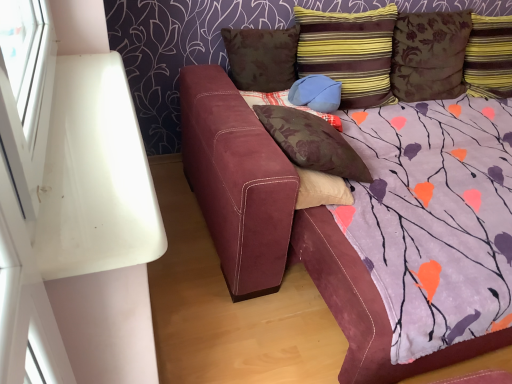
Question: From a real-world perspective, does striped fabric pillow at upper right, which appears as the fourth pillow when viewed from the left, stand above striped fabric pillow at upper right, which appears as the first pillow when viewed from the right?

Choices:
 (A) yes
 (B) no

Answer: (A)

Question: Is striped fabric pillow at upper right, the 3th pillow viewed from the right, outside striped fabric pillow at upper right, the sixth pillow positioned from the left?

Choices:
 (A) yes
 (B) no

Answer: (A)

Question: Is the position of striped fabric pillow at upper right, which appears as the fourth pillow when viewed from the left, less distant than that of striped fabric pillow at upper right, which appears as the first pillow when viewed from the right?

Choices:
 (A) yes
 (B) no

Answer: (A)

Question: Is striped fabric pillow at upper right, the sixth pillow positioned from the left, surrounded by striped fabric pillow at upper right, the 3th pillow viewed from the right?

Choices:
 (A) yes
 (B) no

Answer: (B)

Question: Could you tell me if striped fabric pillow at upper right, which appears as the fourth pillow when viewed from the left, is turned towards striped fabric pillow at upper right, which appears as the first pillow when viewed from the right?

Choices:
 (A) yes
 (B) no

Answer: (B)

Question: Is striped fabric pillow at upper right, which appears as the fourth pillow when viewed from the left, not close to striped fabric pillow at upper right, which appears as the first pillow when viewed from the right?

Choices:
 (A) yes
 (B) no

Answer: (B)

Question: Is striped fabric pillow at upper right, which appears as the fourth pillow when viewed from the left, surrounding suede blue pillow at center, the 4th pillow from the right?

Choices:
 (A) no
 (B) yes

Answer: (B)

Question: Does striped fabric pillow at upper right, which appears as the fourth pillow when viewed from the left, turn towards suede blue pillow at center, the 4th pillow from the right?

Choices:
 (A) no
 (B) yes

Answer: (B)

Question: Considering the relative positions of striped fabric pillow at upper right, which appears as the fourth pillow when viewed from the left, and suede blue pillow at center, the third pillow when ordered from left to right, in the image provided, is striped fabric pillow at upper right, which appears as the fourth pillow when viewed from the left, to the right of suede blue pillow at center, the third pillow when ordered from left to right, from the viewer's perspective?

Choices:
 (A) yes
 (B) no

Answer: (A)

Question: Does striped fabric pillow at upper right, the 3th pillow viewed from the right, have a smaller size compared to suede blue pillow at center, the third pillow when ordered from left to right?

Choices:
 (A) yes
 (B) no

Answer: (B)

Question: Is there a large distance between striped fabric pillow at upper right, the 3th pillow viewed from the right, and suede blue pillow at center, the 4th pillow from the right?

Choices:
 (A) yes
 (B) no

Answer: (B)

Question: Is striped fabric pillow at upper right, the 3th pillow viewed from the right, oriented away from suede blue pillow at center, the third pillow when ordered from left to right?

Choices:
 (A) yes
 (B) no

Answer: (B)

Question: Can brown floral pillow at upper center, positioned as the sixth pillow in right-to-left order, be found inside striped fabric pillow at upper right, the 3th pillow viewed from the right?

Choices:
 (A) no
 (B) yes

Answer: (A)